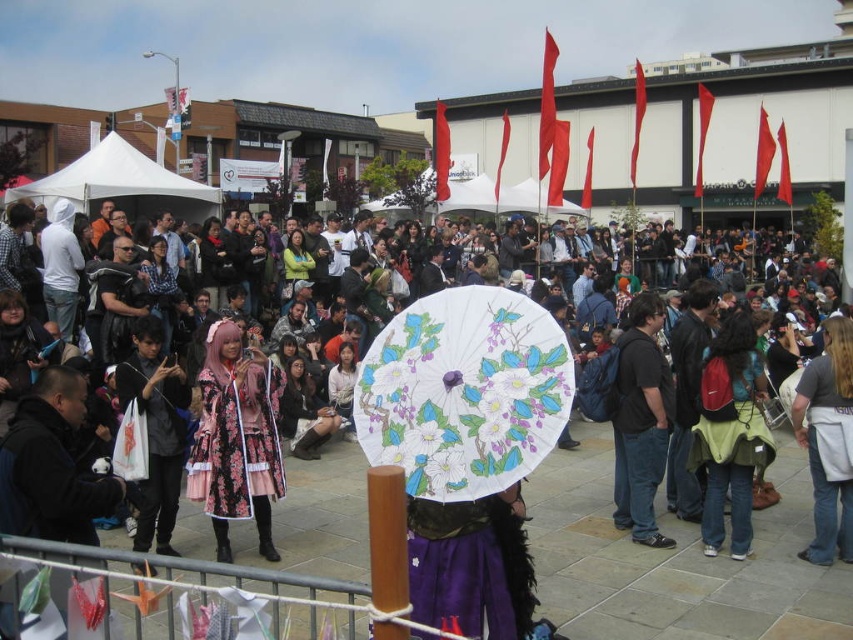
You are a photographer at the event and want to take a photo of the green fabric backpack at center and the floral fabric dress at center. Which object should you focus on first if you want to capture both in the frame without moving the camera?

The green fabric backpack at center has a lesser height compared to floral fabric dress at center, so you should focus on the floral fabric dress at center first as it is taller and will require more space in the frame.

You are at the event and want to locate the green fabric backpack at center and the floral fabric dress at center. According to the scene description, which one is positioned to the right of the other?

The green fabric backpack at center is to the right of the floral fabric dress at center.

You are at the festival and want to take a photo under the white paper umbrella at center. To avoid the white canvas canopy at upper left from blocking the sunlight, which direction should you position yourself relative to the umbrella?

Position yourself to the left of the white paper umbrella at center since the white canvas canopy at upper left is located to its left, so standing there would place the umbrella between you and the canopy, allowing sunlight to reach you without obstruction.